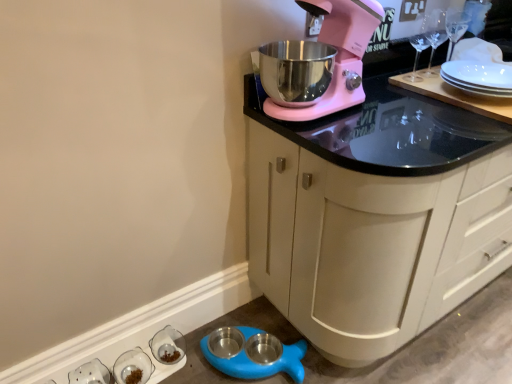
Question: From the image's perspective, relative to clear glass bowls at lower left, marked as the 2th tableware in a right-to-left arrangement, is clear glass bowl at lower left, arranged as the 3th tableware when viewed from the left, above or below?

Choices:
 (A) above
 (B) below

Answer: (A)

Question: From a real-world perspective, relative to clear glass bowls at lower left, marked as the 2th tableware in a right-to-left arrangement, is clear glass bowl at lower left, the 1th tableware viewed from the right, vertically above or below?

Choices:
 (A) above
 (B) below

Answer: (B)

Question: Which object is positioned closest to the pink matte mixer at upper right?

Choices:
 (A) clear glass bowl at lower left, the 1th tableware viewed from the right
 (B) matte white cabinet at upper right
 (C) white glossy salt and pepper shakers at lower left, acting as the 3th tableware starting from the right
 (D) blue rubber pet bowls at lower left
 (E) clear glass bowls at lower left, the 2th tableware when ordered from left to right

Answer: (B)

Question: Which object is positioned closest to the pink matte mixer at upper right?

Choices:
 (A) white glossy salt and pepper shakers at lower left, acting as the 3th tableware starting from the right
 (B) clear glass bowl at lower left, the 1th tableware viewed from the right
 (C) matte white cabinet at upper right
 (D) blue rubber pet bowls at lower left
 (E) clear glass bowls at lower left, marked as the 2th tableware in a right-to-left arrangement

Answer: (C)